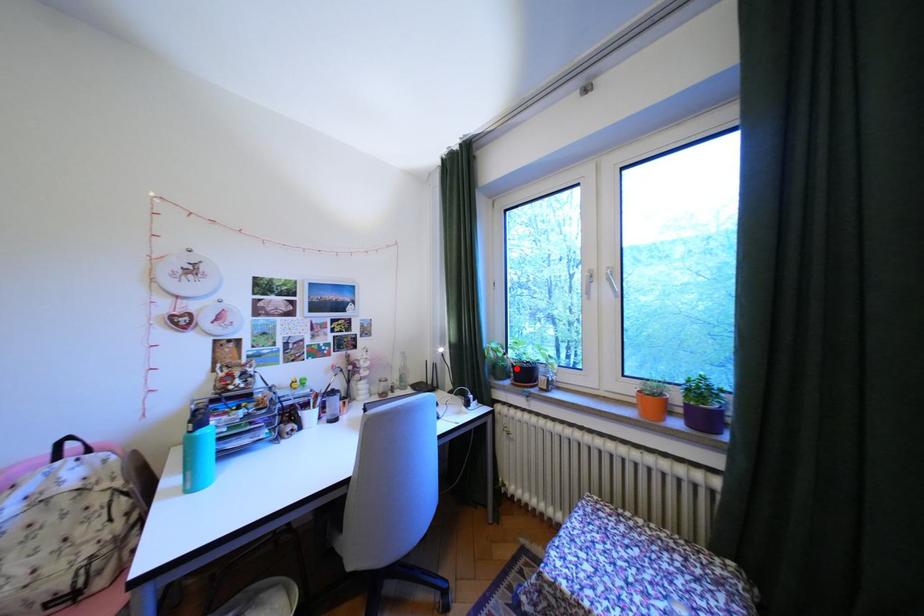
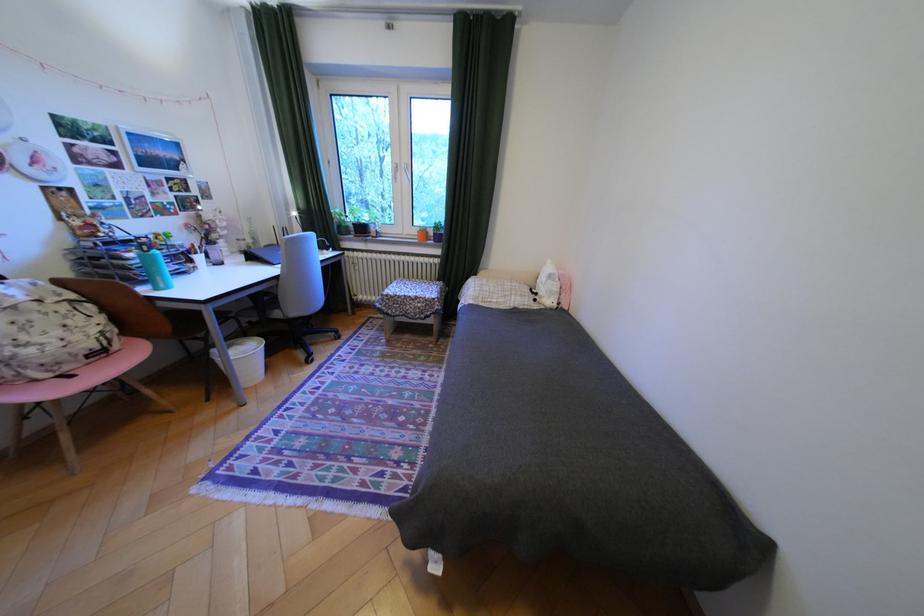
In the second image, find the point that corresponds to the highlighted location in the first image.

(359, 227)